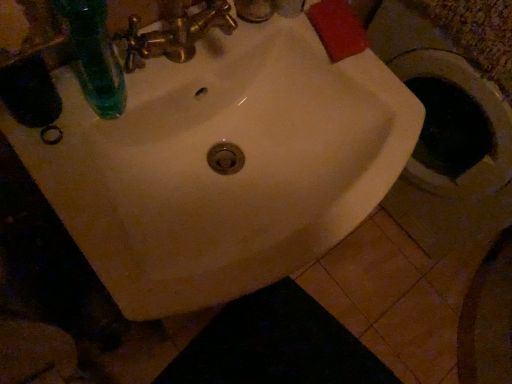
Question: Is gold metallic faucet at upper center not near green glass bottle at upper left?

Choices:
 (A) yes
 (B) no

Answer: (B)

Question: Is the surface of gold metallic faucet at upper center in direct contact with green glass bottle at upper left?

Choices:
 (A) yes
 (B) no

Answer: (B)

Question: Can you confirm if gold metallic faucet at upper center is wider than green glass bottle at upper left?

Choices:
 (A) no
 (B) yes

Answer: (A)

Question: Can you confirm if gold metallic faucet at upper center is thinner than green glass bottle at upper left?

Choices:
 (A) yes
 (B) no

Answer: (A)

Question: Is gold metallic faucet at upper center in front of green glass bottle at upper left?

Choices:
 (A) no
 (B) yes

Answer: (A)

Question: From a real-world perspective, is white glossy sink at center above or below black fabric at lower center?

Choices:
 (A) above
 (B) below

Answer: (A)

Question: Is white glossy sink at center inside or outside of black fabric at lower center?

Choices:
 (A) outside
 (B) inside

Answer: (A)

Question: Looking at the image, does white glossy sink at center seem bigger or smaller compared to black fabric at lower center?

Choices:
 (A) big
 (B) small

Answer: (A)

Question: Is white glossy sink at center to the left or to the right of black fabric at lower center in the image?

Choices:
 (A) right
 (B) left

Answer: (B)

Question: From a real-world perspective, is black fabric at lower center above or below green glass bottle at upper left?

Choices:
 (A) below
 (B) above

Answer: (A)

Question: Would you say black fabric at lower center is to the left or to the right of green glass bottle at upper left in the picture?

Choices:
 (A) right
 (B) left

Answer: (A)

Question: Looking at their shapes, would you say black fabric at lower center is wider or thinner than green glass bottle at upper left?

Choices:
 (A) wide
 (B) thin

Answer: (A)

Question: Is black fabric at lower center in front of or behind green glass bottle at upper left in the image?

Choices:
 (A) behind
 (B) front

Answer: (A)

Question: In terms of width, does gold metallic faucet at upper center look wider or thinner when compared to white glossy sink at center?

Choices:
 (A) wide
 (B) thin

Answer: (B)

Question: Is gold metallic faucet at upper center situated inside white glossy sink at center or outside?

Choices:
 (A) inside
 (B) outside

Answer: (B)